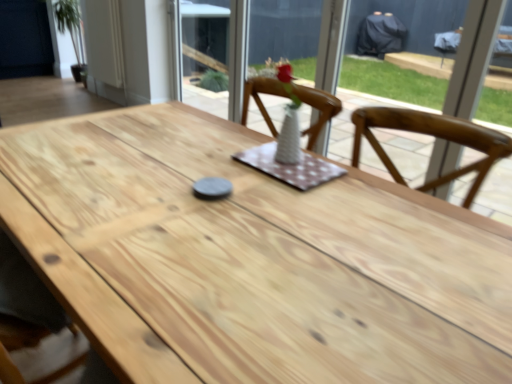
Locate an element on the screen. This screenshot has height=384, width=512. free space above natural wood table at center (from a real-world perspective) is located at coordinates (265, 246).